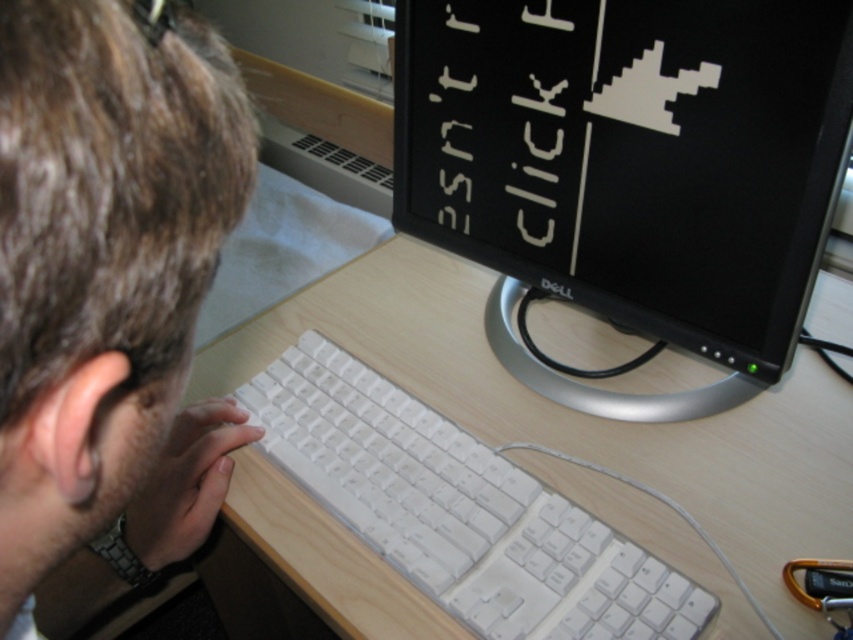
You are a photographer taking a portrait of the person seated at the desk. The light brown hair at upper left and the white plastic keyboard at center are both in the frame. Which object appears bigger in the photo?

The light brown hair at upper left appears bigger in the photo because it is larger in size than the white plastic keyboard at center.

You are setting up a new desk arrangement and want to place a decorative item between the black glossy monitor at upper center and the white plastic keyboard at center. Considering their sizes, which object should the decorative item be placed closer to?

The decorative item should be placed closer to the white plastic keyboard at center because the black glossy monitor at upper center is taller than the white plastic keyboard at center, meaning the keyboard is shorter and thus the space between them would require the item to be nearer to the shorter object to balance the arrangement.

You are a person trying to reach the white plastic keyboard at center while sitting in front of the desk. The black glossy monitor at upper center is blocking your view. Can you move your hand under the monitor to access the keyboard?

The black glossy monitor at upper center is in front of the white plastic keyboard at center, so you can move your hand under the monitor to access the keyboard since it is positioned in front of the keyboard.